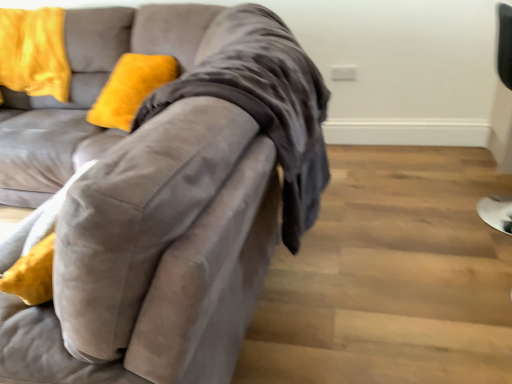
Find the location of a particular element. free region under black leather chair at right (from a real-world perspective) is located at coordinates (481, 221).